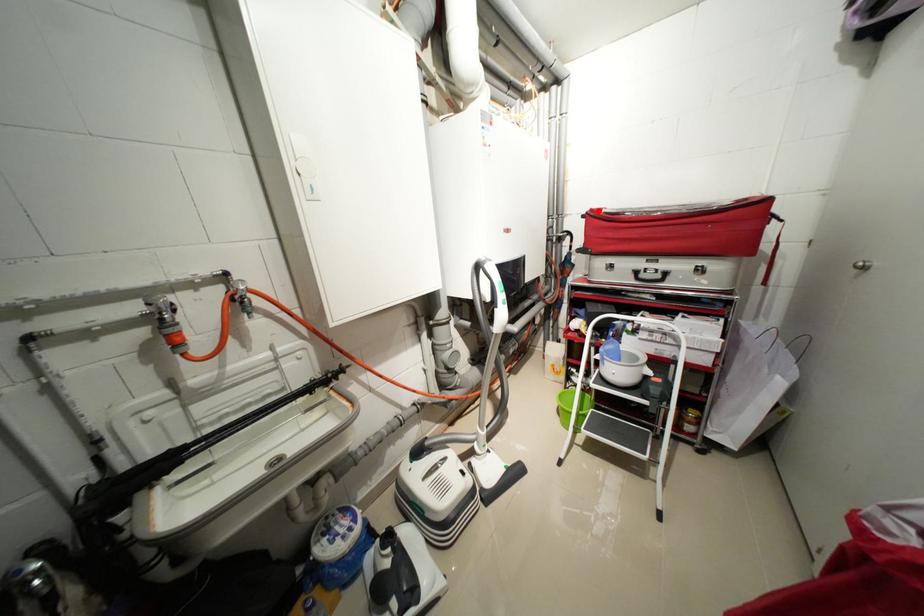
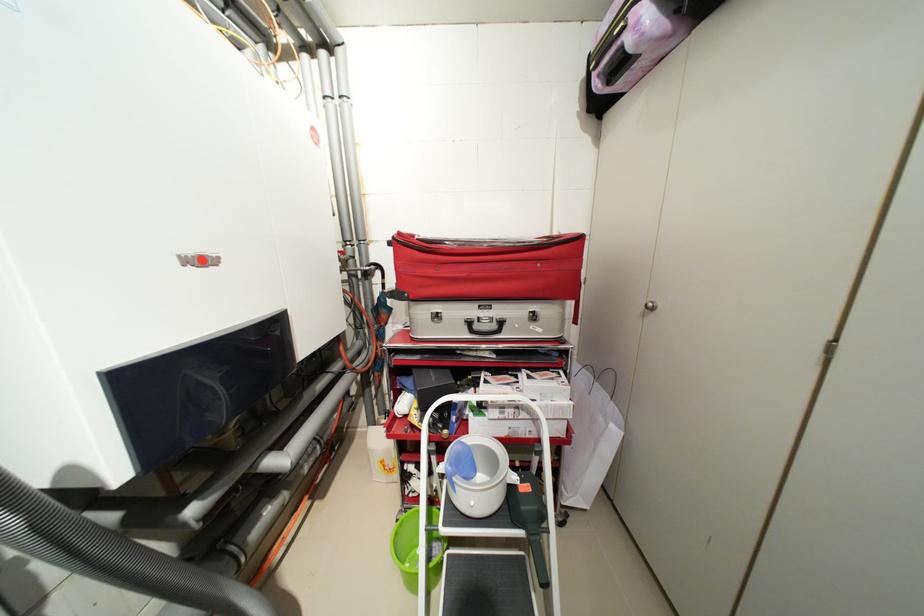
In the second image, find the point that corresponds to the highlighted location in the first image.

(407, 235)